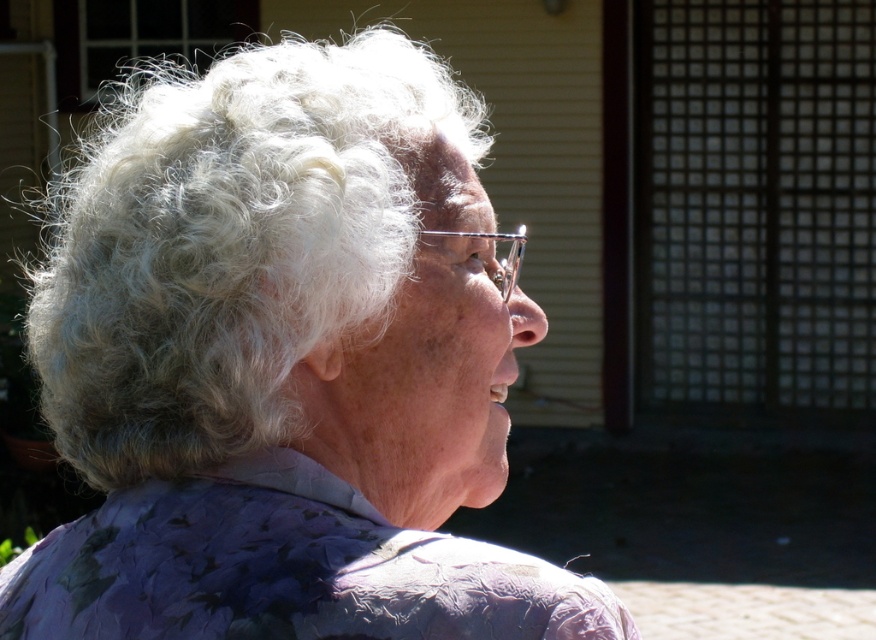
Does white curly hair at upper left appear on the left side of purple floral fabric at lower center?

Incorrect, white curly hair at upper left is not on the left side of purple floral fabric at lower center.

Is point (475, 314) in front of point (161, 612)?

No, it is behind (161, 612).

Who is more distant from viewer, (387, 570) or (630, 627)?

Positioned behind is point (630, 627).

At what (x,y) coordinates should I click in order to perform the action: click on white curly hair at upper left. Please return your answer as a coordinate pair (x, y). The width and height of the screenshot is (876, 640). Looking at the image, I should click on (286, 364).